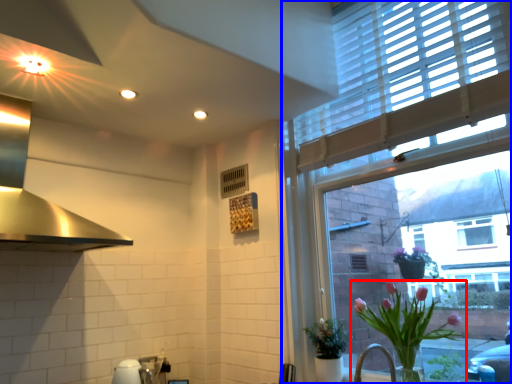
Question: Which point is closer to the camera, houseplant (highlighted by a red box) or window (highlighted by a blue box)?

Choices:
 (A) houseplant
 (B) window

Answer: (B)